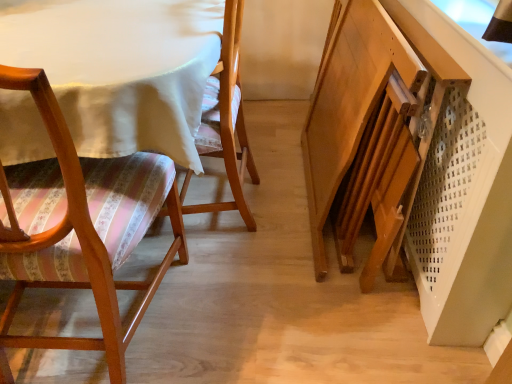
Measure the distance between wooden floral-patterned chair at left, the 1th chair viewed from the right, and camera.

wooden floral-patterned chair at left, the 1th chair viewed from the right, is 1.12 meters away from camera.

The image size is (512, 384). What do you see at coordinates (227, 120) in the screenshot?
I see `wooden floral-patterned chair at left, the 1th chair viewed from the right` at bounding box center [227, 120].

The height and width of the screenshot is (384, 512). Identify the location of wooden floral-patterned chair at left, which ranks as the second chair in left-to-right order. (227, 120).

I want to click on matte wood chair at left, which appears as the first chair when viewed from the left, so click(79, 227).

What do you see at coordinates (79, 227) in the screenshot?
I see `matte wood chair at left, the second chair from the right` at bounding box center [79, 227].

You are a GUI agent. You are given a task and a screenshot of the screen. Output one action in this format:
    pyautogui.click(x=<x>, y=<y>)
    Task: Click on the wooden floral-patterned chair at left, the 1th chair viewed from the right
    
    Given the screenshot: What is the action you would take?
    pyautogui.click(x=227, y=120)

Which object is positioned more to the left, wooden floral-patterned chair at left, which ranks as the second chair in left-to-right order, or matte wood chair at left, the second chair from the right?

From the viewer's perspective, matte wood chair at left, the second chair from the right, appears more on the left side.

Considering the positions of objects wooden floral-patterned chair at left, the 1th chair viewed from the right, and matte wood chair at left, the second chair from the right, in the image provided, who is behind, wooden floral-patterned chair at left, the 1th chair viewed from the right, or matte wood chair at left, the second chair from the right,?

wooden floral-patterned chair at left, the 1th chair viewed from the right, is more distant.

Is point (242, 131) closer or farther from the camera than point (147, 281)?

Point (242, 131) is positioned farther from the camera compared to point (147, 281).

From the image's perspective, is wooden floral-patterned chair at left, which ranks as the second chair in left-to-right order, located beneath matte wood chair at left, which appears as the first chair when viewed from the left?

Actually, wooden floral-patterned chair at left, which ranks as the second chair in left-to-right order, appears above matte wood chair at left, which appears as the first chair when viewed from the left, in the image.

From a real-world perspective, is wooden floral-patterned chair at left, which ranks as the second chair in left-to-right order, beneath matte wood chair at left, the second chair from the right?

Correct, in the physical world, wooden floral-patterned chair at left, which ranks as the second chair in left-to-right order, is lower than matte wood chair at left, the second chair from the right.

Is wooden floral-patterned chair at left, the 1th chair viewed from the right, thinner than matte wood chair at left, the second chair from the right?

Indeed, wooden floral-patterned chair at left, the 1th chair viewed from the right, has a lesser width compared to matte wood chair at left, the second chair from the right.

Is wooden floral-patterned chair at left, the 1th chair viewed from the right, shorter than matte wood chair at left, which appears as the first chair when viewed from the left?

Yes, wooden floral-patterned chair at left, the 1th chair viewed from the right, is shorter than matte wood chair at left, which appears as the first chair when viewed from the left.

From the picture: Considering the relative sizes of wooden floral-patterned chair at left, the 1th chair viewed from the right, and matte wood chair at left, which appears as the first chair when viewed from the left, in the image provided, is wooden floral-patterned chair at left, the 1th chair viewed from the right, smaller than matte wood chair at left, which appears as the first chair when viewed from the left,?

Yes.

Does wooden floral-patterned chair at left, the 1th chair viewed from the right, contain matte wood chair at left, which appears as the first chair when viewed from the left?

No, matte wood chair at left, which appears as the first chair when viewed from the left, is not a part of wooden floral-patterned chair at left, the 1th chair viewed from the right.

Can you see wooden floral-patterned chair at left, the 1th chair viewed from the right, touching matte wood chair at left, the second chair from the right?

No, wooden floral-patterned chair at left, the 1th chair viewed from the right, is not next to matte wood chair at left, the second chair from the right.

Is wooden floral-patterned chair at left, which ranks as the second chair in left-to-right order, oriented towards matte wood chair at left, which appears as the first chair when viewed from the left?

No, wooden floral-patterned chair at left, which ranks as the second chair in left-to-right order, is not oriented towards matte wood chair at left, which appears as the first chair when viewed from the left.

How many degrees apart are the facing directions of wooden floral-patterned chair at left, the 1th chair viewed from the right, and matte wood chair at left, the second chair from the right?

88.6 degrees separate the facing orientations of wooden floral-patterned chair at left, the 1th chair viewed from the right, and matte wood chair at left, the second chair from the right.

The image size is (512, 384). I want to click on chair below the wooden floral-patterned chair at left, the 1th chair viewed from the right (from the image's perspective), so click(79, 227).

Considering the relative positions of matte wood chair at left, which appears as the first chair when viewed from the left, and wooden floral-patterned chair at left, which ranks as the second chair in left-to-right order, in the image provided, is matte wood chair at left, which appears as the first chair when viewed from the left, to the right of wooden floral-patterned chair at left, which ranks as the second chair in left-to-right order, from the viewer's perspective?

In fact, matte wood chair at left, which appears as the first chair when viewed from the left, is to the left of wooden floral-patterned chair at left, which ranks as the second chair in left-to-right order.

Does matte wood chair at left, which appears as the first chair when viewed from the left, lie behind wooden floral-patterned chair at left, the 1th chair viewed from the right?

No, the depth of matte wood chair at left, which appears as the first chair when viewed from the left, is less than that of wooden floral-patterned chair at left, the 1th chair viewed from the right.

Is point (51, 235) positioned in front of point (240, 0)?

Yes, point (51, 235) is in front of point (240, 0).

From the image's perspective, is matte wood chair at left, which appears as the first chair when viewed from the left, beneath wooden floral-patterned chair at left, the 1th chair viewed from the right?

Correct, matte wood chair at left, which appears as the first chair when viewed from the left, appears lower than wooden floral-patterned chair at left, the 1th chair viewed from the right, in the image.

Looking at this image, from a real-world perspective, who is located lower, matte wood chair at left, the second chair from the right, or wooden floral-patterned chair at left, the 1th chair viewed from the right?

In real-world perspective, wooden floral-patterned chair at left, the 1th chair viewed from the right, is lower.

Looking at their sizes, would you say matte wood chair at left, which appears as the first chair when viewed from the left, is wider or thinner than wooden floral-patterned chair at left, the 1th chair viewed from the right?

Clearly, matte wood chair at left, which appears as the first chair when viewed from the left, has more width compared to wooden floral-patterned chair at left, the 1th chair viewed from the right.

Can you confirm if matte wood chair at left, the second chair from the right, is shorter than wooden floral-patterned chair at left, which ranks as the second chair in left-to-right order?

In fact, matte wood chair at left, the second chair from the right, may be taller than wooden floral-patterned chair at left, which ranks as the second chair in left-to-right order.

From the picture: Which of these two, matte wood chair at left, the second chair from the right, or wooden floral-patterned chair at left, which ranks as the second chair in left-to-right order, is smaller?

With smaller size is wooden floral-patterned chair at left, which ranks as the second chair in left-to-right order.

Consider the image. Can we say matte wood chair at left, which appears as the first chair when viewed from the left, lies outside wooden floral-patterned chair at left, the 1th chair viewed from the right?

→ Absolutely, matte wood chair at left, which appears as the first chair when viewed from the left, is external to wooden floral-patterned chair at left, the 1th chair viewed from the right.

Is matte wood chair at left, the second chair from the right, far from wooden floral-patterned chair at left, the 1th chair viewed from the right?

matte wood chair at left, the second chair from the right, is actually quite close to wooden floral-patterned chair at left, the 1th chair viewed from the right.

Is matte wood chair at left, which appears as the first chair when viewed from the left, oriented towards wooden floral-patterned chair at left, which ranks as the second chair in left-to-right order?

Yes.

What's the angular difference between matte wood chair at left, the second chair from the right, and wooden floral-patterned chair at left, the 1th chair viewed from the right,'s facing directions?

88.6 degrees.

This screenshot has height=384, width=512. I want to click on chair directly beneath the matte wood chair at left, which appears as the first chair when viewed from the left (from a real-world perspective), so click(227, 120).

This screenshot has width=512, height=384. Find the location of `chair in front of the wooden floral-patterned chair at left, which ranks as the second chair in left-to-right order`. chair in front of the wooden floral-patterned chair at left, which ranks as the second chair in left-to-right order is located at coordinates tap(79, 227).

Where is `chair that is behind the matte wood chair at left, which appears as the first chair when viewed from the left`? chair that is behind the matte wood chair at left, which appears as the first chair when viewed from the left is located at coordinates (227, 120).